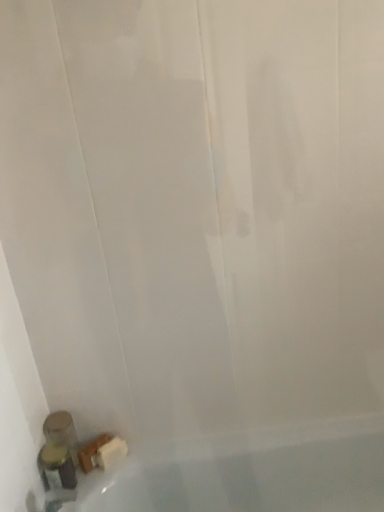
Question: Which is correct: translucent plastic soap at lower left, the second toiletry positioned from the front, is inside metallic silver soap dispenser at lower left, placed as the first toiletry when sorted from front to back, or outside of it?

Choices:
 (A) inside
 (B) outside

Answer: (B)

Question: Considering their positions, is translucent plastic soap at lower left, the second toiletry positioned from the front, located in front of or behind metallic silver soap dispenser at lower left, placed as the first toiletry when sorted from front to back?

Choices:
 (A) behind
 (B) front

Answer: (A)

Question: Considering the relative positions of translucent plastic soap at lower left, which is the 1th toiletry in back-to-front order, and metallic silver soap dispenser at lower left, placed as the first toiletry when sorted from front to back, in the image provided, is translucent plastic soap at lower left, which is the 1th toiletry in back-to-front order, to the left or to the right of metallic silver soap dispenser at lower left, placed as the first toiletry when sorted from front to back,?

Choices:
 (A) right
 (B) left

Answer: (B)

Question: Which is correct: metallic silver soap dispenser at lower left, placed as the first toiletry when sorted from front to back, is inside translucent plastic soap at lower left, the second toiletry positioned from the front, or outside of it?

Choices:
 (A) inside
 (B) outside

Answer: (B)

Question: Looking at the image, does metallic silver soap dispenser at lower left, placed as the first toiletry when sorted from front to back, seem bigger or smaller compared to translucent plastic soap at lower left, which is the 1th toiletry in back-to-front order?

Choices:
 (A) big
 (B) small

Answer: (B)

Question: From a real-world perspective, is metallic silver soap dispenser at lower left, placed as the first toiletry when sorted from front to back, above or below translucent plastic soap at lower left, which is the 1th toiletry in back-to-front order?

Choices:
 (A) below
 (B) above

Answer: (A)

Question: From the image's perspective, is metallic silver soap dispenser at lower left, the 2th toiletry when ordered from back to front, located above or below translucent plastic soap at lower left, which is the 1th toiletry in back-to-front order?

Choices:
 (A) below
 (B) above

Answer: (A)